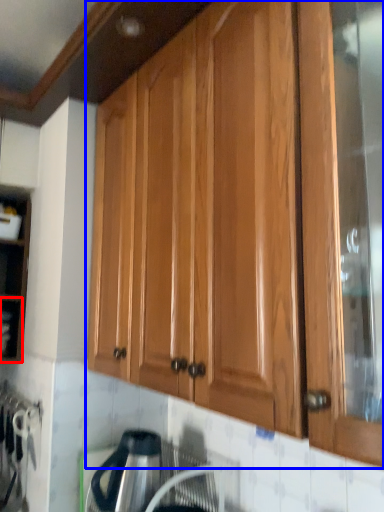
Question: Which object is closer to the camera taking this photo, shelf (highlighted by a red box) or cabinetry (highlighted by a blue box)?

Choices:
 (A) shelf
 (B) cabinetry

Answer: (B)